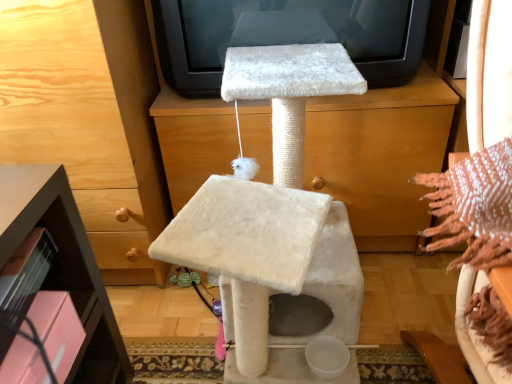
The height and width of the screenshot is (384, 512). Describe the element at coordinates (89, 119) in the screenshot. I see `wooden drawer at lower left` at that location.

You are a GUI agent. You are given a task and a screenshot of the screen. Output one action in this format:
    pyautogui.click(x=<x>, y=<y>)
    Task: Click on the wooden drawer at lower left
    The image size is (512, 384).
    Given the screenshot: What is the action you would take?
    pyautogui.click(x=89, y=119)

The height and width of the screenshot is (384, 512). In order to click on wooden drawer at lower left in this screenshot , I will do `click(89, 119)`.